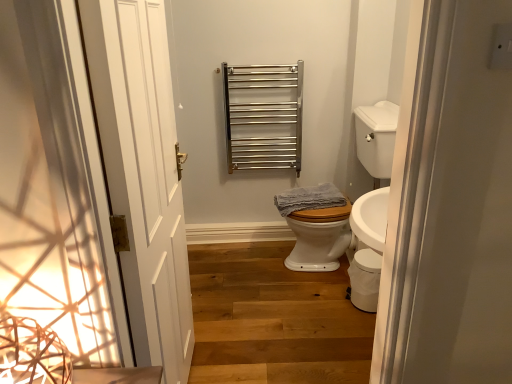
The height and width of the screenshot is (384, 512). What are the coordinates of `free point above wooden stairs at center (from a real-world perspective)` in the screenshot? It's located at (270, 304).